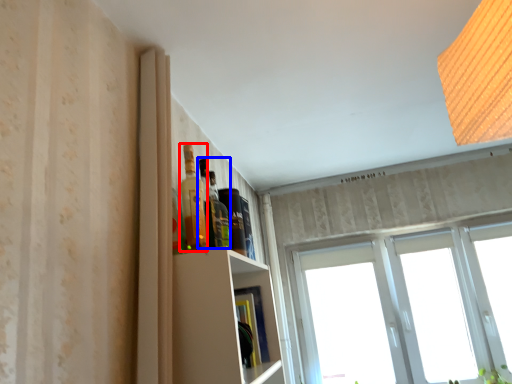
Question: Which point is further to the camera, bottle (highlighted by a red box) or bottle (highlighted by a blue box)?

Choices:
 (A) bottle
 (B) bottle

Answer: (B)